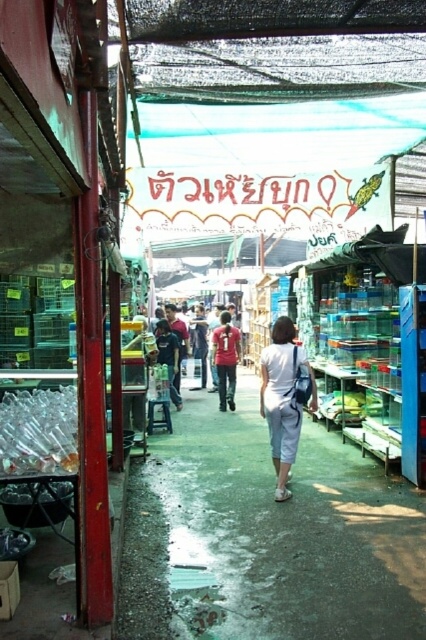
Question: Where is white cotton pants at center located in relation to red matte shirt at center in the image?

Choices:
 (A) left
 (B) right

Answer: (B)

Question: Can you confirm if concrete floor at center is wider than red matte shirt at center?

Choices:
 (A) yes
 (B) no

Answer: (A)

Question: Which of the following is the farthest from the observer?

Choices:
 (A) concrete floor at center
 (B) white cotton pants at center

Answer: (B)

Question: Which object is farther from the camera taking this photo?

Choices:
 (A) white cotton pants at center
 (B) red matte shirt at center
 (C) concrete floor at center

Answer: (B)

Question: Does concrete floor at center have a larger size compared to white cotton pants at center?

Choices:
 (A) yes
 (B) no

Answer: (B)

Question: Which object is the closest to the concrete floor at center?

Choices:
 (A) white cotton pants at center
 (B) red matte shirt at center

Answer: (A)